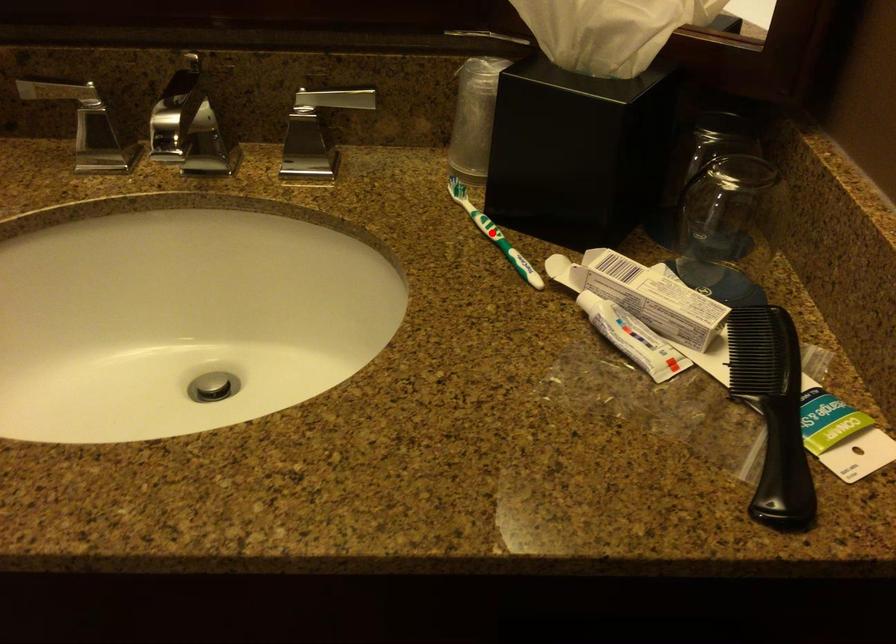
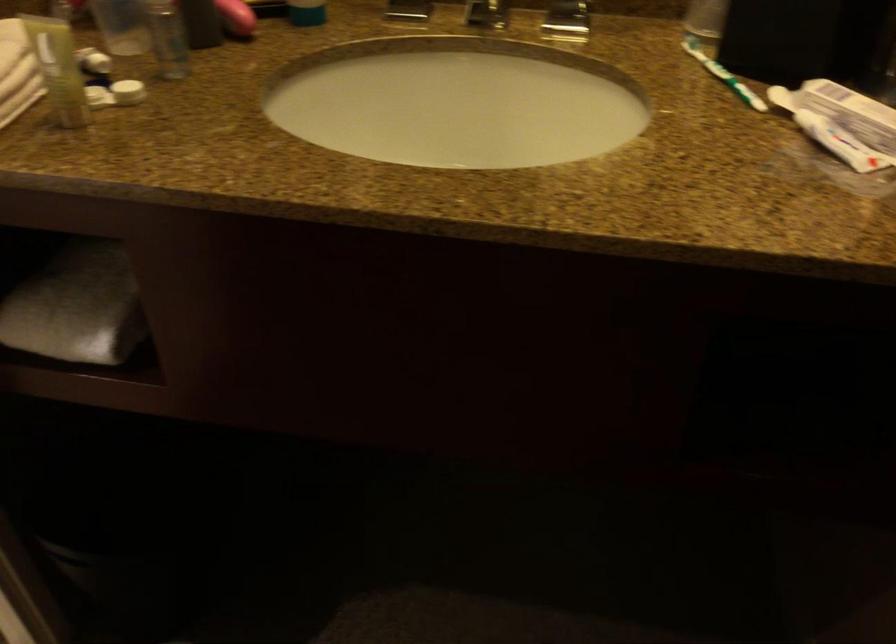
Question: I am providing you with two images of the same scene from different viewpoints. A red point is marked on the first image. Can you still see the location of the red point in image 2?

Choices:
 (A) Yes
 (B) No

Answer: (A)